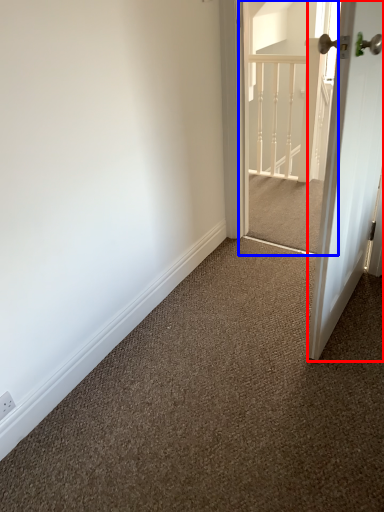
Question: Which object appears farthest to the camera in this image, door (highlighted by a red box) or screen door (highlighted by a blue box)?

Choices:
 (A) door
 (B) screen door

Answer: (B)